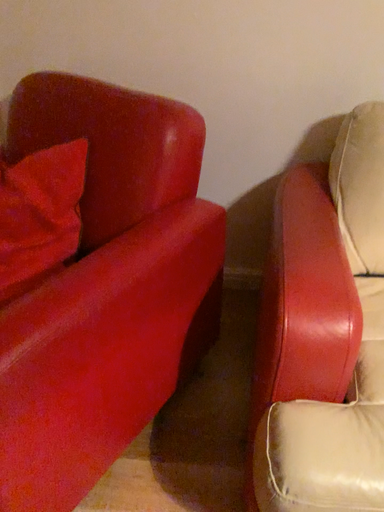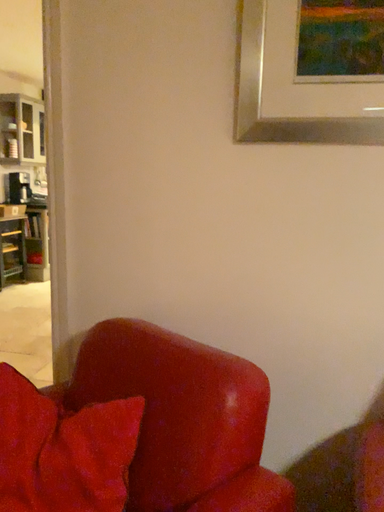
Question: Which way did the camera rotate in the video?

Choices:
 (A) rotated downward
 (B) rotated upward

Answer: (B)